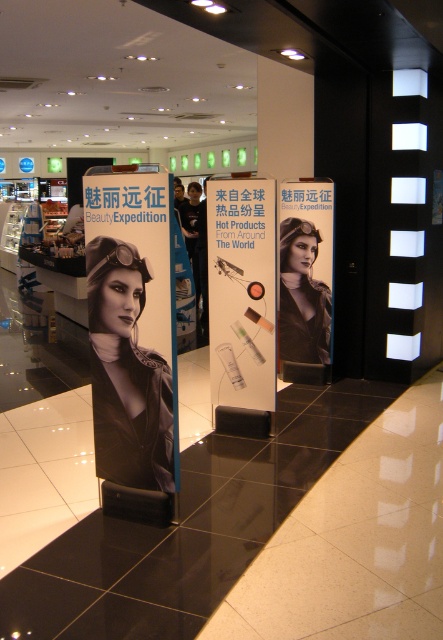
Which of these two, black glossy poster at center or white paper at center, stands taller?

white paper at center is taller.

Does point (97, 307) lie behind point (230, 273)?

That is False.

At what (x,y) coordinates should I click in order to perform the action: click on black glossy poster at center. Please return your answer as a coordinate pair (x, y). The image size is (443, 640). Looking at the image, I should click on (125, 372).

Does white paper at center appear on the left side of matte black helmet at center?

Correct, you'll find white paper at center to the left of matte black helmet at center.

Is white paper at center bigger than matte black helmet at center?

Yes, white paper at center is bigger than matte black helmet at center.

You are a GUI agent. You are given a task and a screenshot of the screen. Output one action in this format:
    pyautogui.click(x=<x>, y=<y>)
    Task: Click on the white paper at center
    The width and height of the screenshot is (443, 640).
    Given the screenshot: What is the action you would take?
    pyautogui.click(x=241, y=294)

Between black glossy poster at center and matte black helmet at center, which one has less height?

Standing shorter between the two is black glossy poster at center.

Is black glossy poster at center in front of matte black helmet at center?

Yes.

The height and width of the screenshot is (640, 443). I want to click on black glossy poster at center, so click(125, 372).